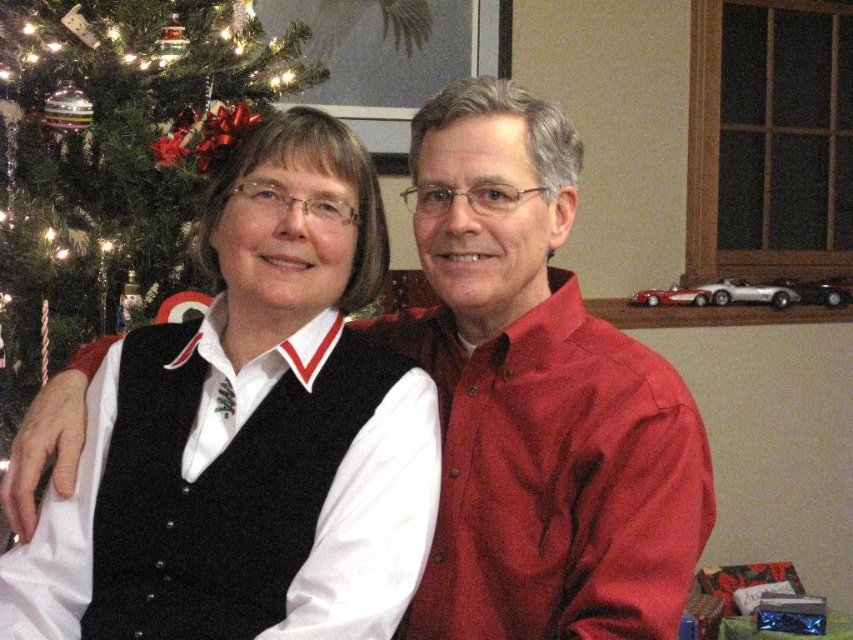
You are standing at the point labeled point [321,154] in a festive holiday photo setup. The camera is positioned somewhere in the scene. If you want to take a photo of the two people in the foreground, will you be able to capture them clearly without moving from your current position?

The distance between you at point [321,154] and the camera is 1.08 meters. Since the two people are in the foreground and the camera is positioned to capture them clearly, you can take their photo without moving as the distance allows for a clear shot.

Based on the photo, you are a photographer adjusting the lighting for a portrait. You notice the black wool vest at left and the matte red shirt at center in the frame. Which clothing item should you focus on first if you want to highlight the one that is higher in the image?

The black wool vest at left is above the matte red shirt at center, so you should focus on the black wool vest at left first to highlight the higher positioned clothing item.

You are a photographer trying to capture a closeup of the black wool vest at left and the green matte christmas tree at left. Which object should you zoom in on to ensure it fits entirely within the frame without cropping?

The black wool vest at left is thinner than the green matte christmas tree at left, so you should zoom in on the black wool vest at left to ensure it fits entirely within the frame without cropping.